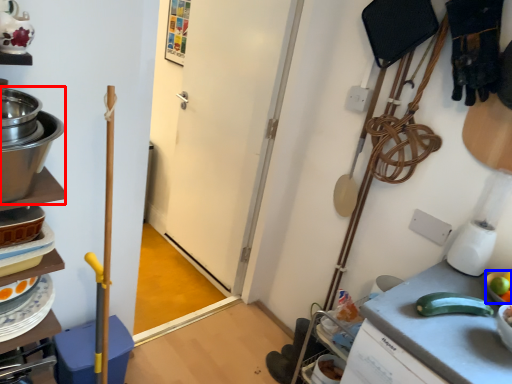
Question: Which object is closer to the camera taking this photo, appliance (highlighted by a red box) or fruit (highlighted by a blue box)?

Choices:
 (A) appliance
 (B) fruit

Answer: (A)